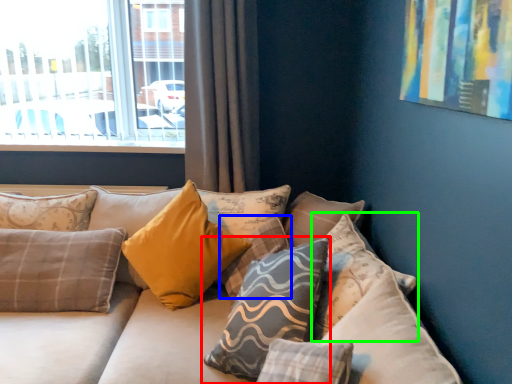
Question: Based on their relative distances, which object is farther from pillow (highlighted by a red box)? Choose from pillow (highlighted by a blue box) and pillow (highlighted by a green box).

Choices:
 (A) pillow
 (B) pillow

Answer: (A)